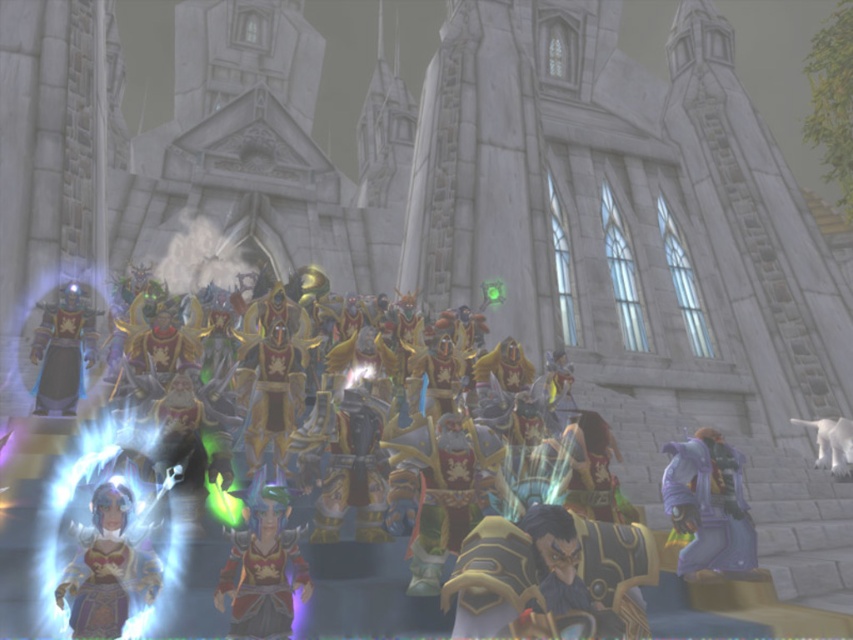
You are a character in the game who needs to reach the purple matte armor at lower right. Based on its coordinates, is it located closer to the bottom or the right edge of the screen?

The purple matte armor at lower right is located at coordinates point (706,504). Since both coordinates are close to 1, it is positioned near the bottom and right edges of the screen, but since the y coordinate is higher than the x coordinate, it is closer to the bottom edge.